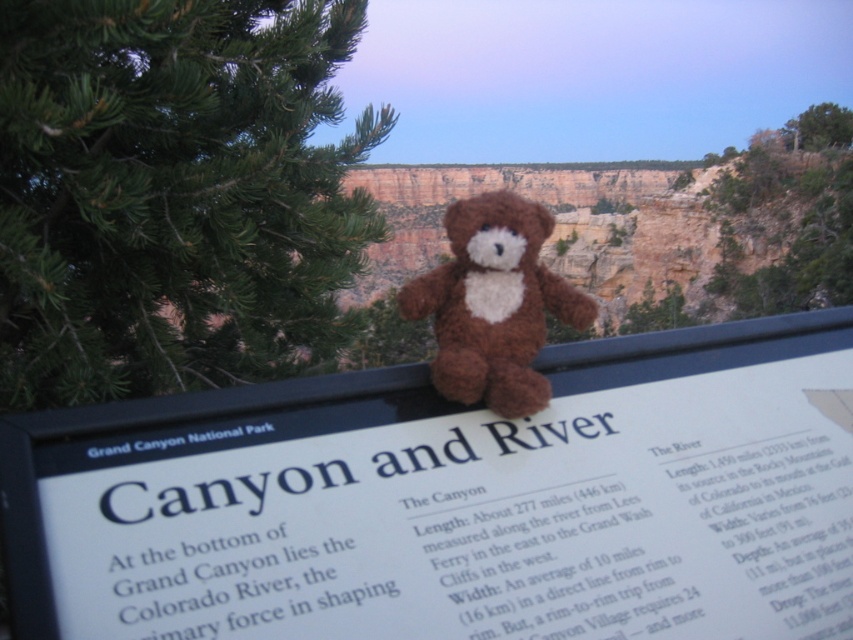
Between white plastic sign at center and brown plush bear at center, which one has less height?

Standing shorter between the two is white plastic sign at center.

Is point (589, 467) positioned in front of point (444, 227)?

Yes, point (589, 467) is closer to viewer.

You are a GUI agent. You are given a task and a screenshot of the screen. Output one action in this format:
    pyautogui.click(x=<x>, y=<y>)
    Task: Click on the white plastic sign at center
    This screenshot has width=853, height=640.
    Given the screenshot: What is the action you would take?
    pyautogui.click(x=456, y=500)

What do you see at coordinates (173, 193) in the screenshot? The height and width of the screenshot is (640, 853). I see `green needle-like at upper left` at bounding box center [173, 193].

Is point (102, 294) more distant than point (525, 220)?

Yes, it is.

At what (x,y) coordinates should I click in order to perform the action: click on green needle-like at upper left. Please return your answer as a coordinate pair (x, y). The width and height of the screenshot is (853, 640). Looking at the image, I should click on (173, 193).

Which is behind, point (801, 452) or point (73, 289)?

The point (73, 289) is more distant.

Does white plastic sign at center have a larger size compared to green needle-like at upper left?

Incorrect, white plastic sign at center is not larger than green needle-like at upper left.

Measure the distance between white plastic sign at center and camera.

white plastic sign at center and camera are 14.11 meters apart.

In order to click on white plastic sign at center in this screenshot , I will do `click(456, 500)`.